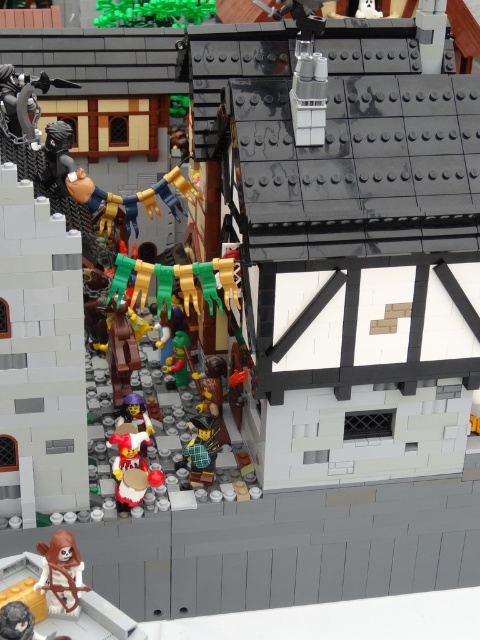
Is green matte bricks at upper center in front of green plaid shirt at center?

No, it is not.

Which of these two, green matte bricks at upper center or green plaid shirt at center, stands taller?

green plaid shirt at center is taller.

Is point (144, 13) positioned before point (192, 474)?

No, it is behind (192, 474).

Identify the location of green matte bricks at upper center. The image size is (480, 640). (154, 12).

Is green matte bricks at upper center above brown matte figure at lower left?

Yes, green matte bricks at upper center is above brown matte figure at lower left.

Is point (107, 1) positioned before point (50, 609)?

No, (107, 1) is behind (50, 609).

The width and height of the screenshot is (480, 640). Identify the location of green matte bricks at upper center. (154, 12).

Who is taller, brown matte figure at lower left or green plaid shirt at center?

With more height is green plaid shirt at center.

Between point (71, 560) and point (206, 476), which one is positioned in front?

Positioned in front is point (71, 560).

Locate an element on the screen. The height and width of the screenshot is (640, 480). brown matte figure at lower left is located at coordinates (61, 572).